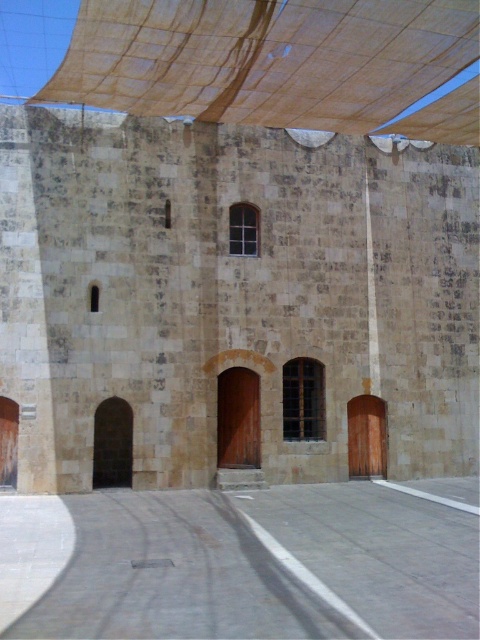
You are standing in front of the brown stone building at center and want to install a new fabric canopy above it. Considering the size of the existing brown fabric canopy at upper center, will the new canopy need to be larger or smaller than the existing one to cover the entire building?

The brown stone building at center is larger in size than the brown fabric canopy at upper center. To cover the entire building, the new canopy needs to be larger than the existing brown fabric canopy at upper center.

You are standing in front of the brown stone building at center and the brown fabric canopy at upper center. Which one appears taller from your perspective?

The brown stone building at center appears taller than the brown fabric canopy at upper center because it has a greater height compared to the canopy.

You are standing in front of the brown stone building at center and looking up. Is the brown fabric canopy at upper center above or below you?

The brown fabric canopy at upper center is above you because it is positioned above the brown stone building at center.